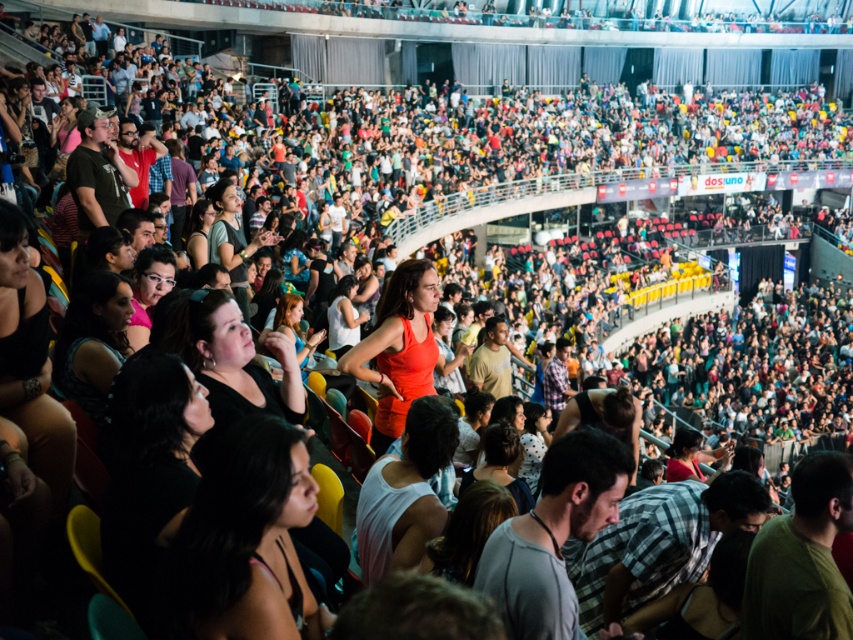
Where is the white matte tank top at center located in the arena?

The white matte tank top at center is located at point (404, 492) in the arena.

You are a photographer at the event and want to capture a photo of both the white matte tank top at center and the matte orange dress at center. Which clothing item is positioned lower in the frame?

The white matte tank top at center is located below the matte orange dress at center, so it is positioned lower in the frame.